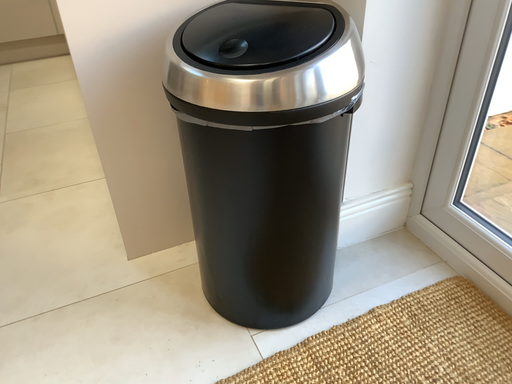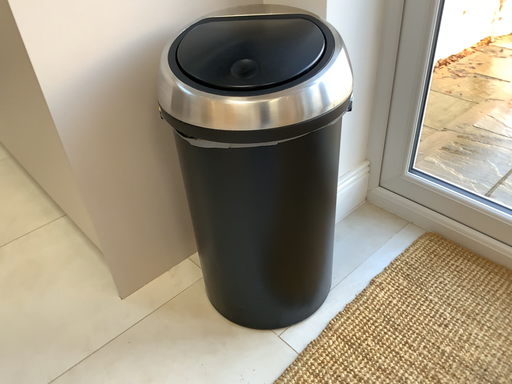
Question: Which way did the camera rotate in the video?

Choices:
 (A) rotated left
 (B) rotated right

Answer: (B)